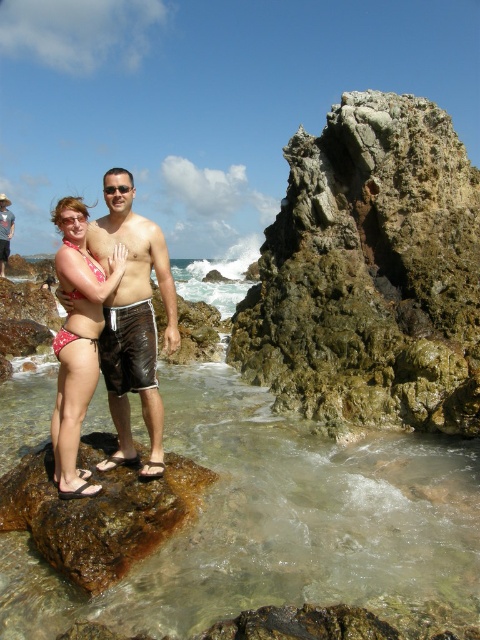
Question: Which of the following is the farthest from the observer?

Choices:
 (A) (452, 573)
 (B) (3, 204)

Answer: (B)

Question: Based on their relative distances, which object is nearer to the brown rough rock at center?

Choices:
 (A) printed bikini bottom at center
 (B) rusty stone rock at center
 (C) brown textured shorts at center
 (D) clear water at rock center

Answer: (A)

Question: Does printed bikini bottom at center have a greater width compared to brown textured shorts at center?

Choices:
 (A) no
 (B) yes

Answer: (A)

Question: Which point is closer to the camera taking this photo?

Choices:
 (A) (130, 497)
 (B) (0, 234)

Answer: (A)

Question: Does brown rough rock at center appear over shiny brown shorts at center?

Choices:
 (A) no
 (B) yes

Answer: (A)

Question: Is the position of clear water at rock center more distant than that of brown textured shorts at center?

Choices:
 (A) yes
 (B) no

Answer: (B)